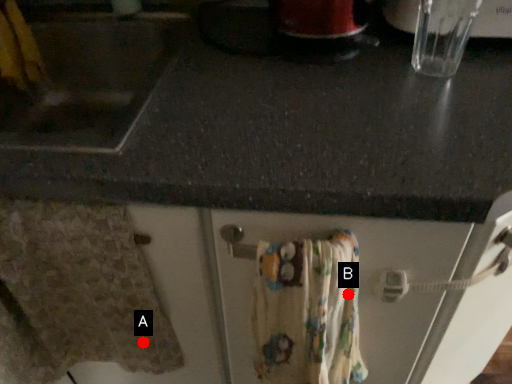
Question: Two points are circled on the image, labeled by A and B beside each circle. Which of the following is the farthest from the observer?

Choices:
 (A) A is further
 (B) B is further

Answer: (A)